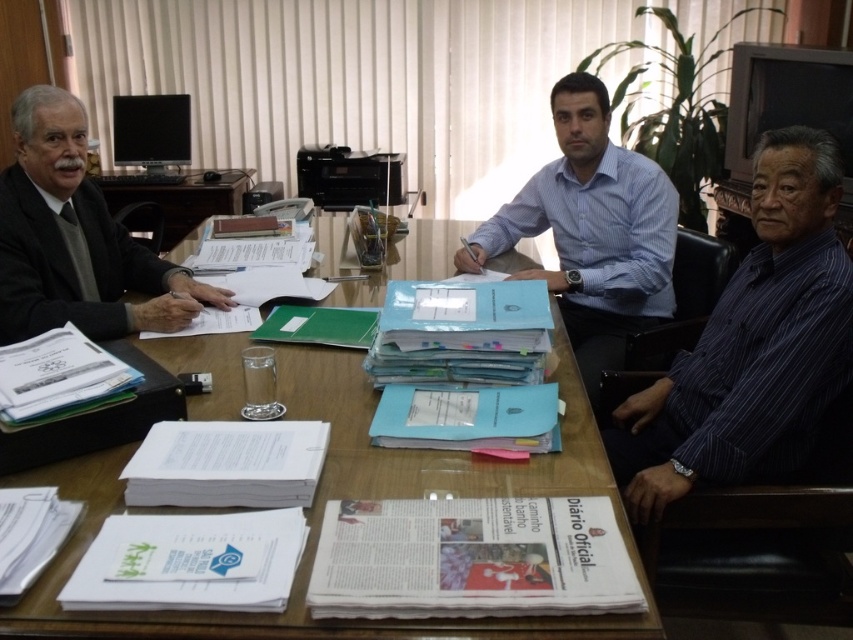
Question: Does dark blue striped shirt at lower right appear under blue striped shirt at center?

Choices:
 (A) yes
 (B) no

Answer: (A)

Question: Estimate the real-world distances between objects in this image. Which object is closer to the blue striped shirt at center?

Choices:
 (A) wooden table at center
 (B) dark blue striped shirt at lower right

Answer: (B)

Question: Observing the image, what is the correct spatial positioning of dark blue striped shirt at lower right in reference to blue striped shirt at center?

Choices:
 (A) above
 (B) below

Answer: (B)

Question: Is wooden table at center closer to the viewer compared to dark blue striped shirt at lower right?

Choices:
 (A) no
 (B) yes

Answer: (B)

Question: Estimate the real-world distances between objects in this image. Which object is closer to the blue striped shirt at center?

Choices:
 (A) gray wool sweater at left
 (B) wooden table at center
 (C) dark blue striped shirt at lower right

Answer: (C)

Question: Among these points, which one is farthest from the camera?

Choices:
 (A) (59, 552)
 (B) (572, 129)

Answer: (B)